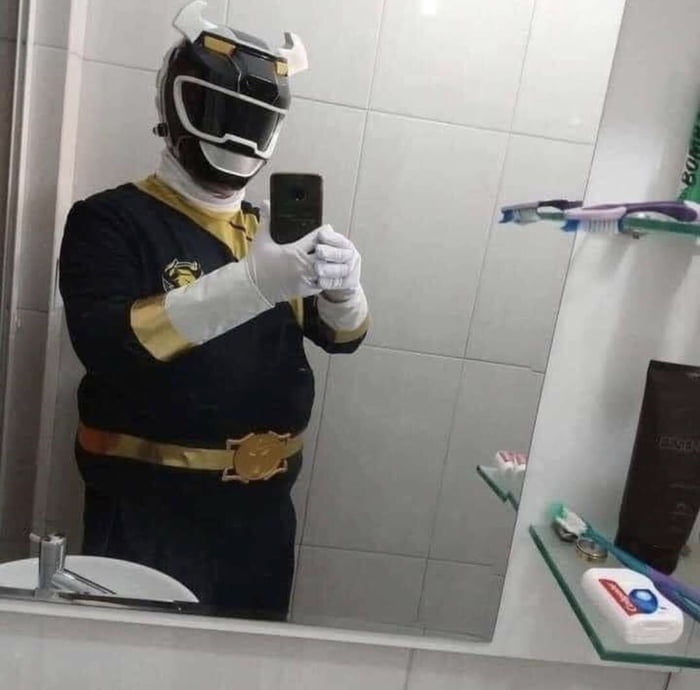
Locate an element on the screen. The width and height of the screenshot is (700, 690). toothbrush is located at coordinates [635, 566], [612, 213].